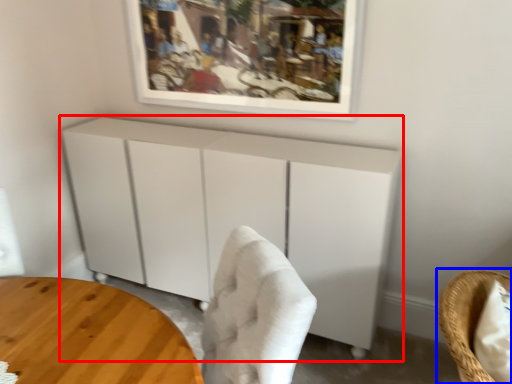
Question: Among these objects, which one is nearest to the camera, cabinetry (highlighted by a red box) or chair (highlighted by a blue box)?

Choices:
 (A) cabinetry
 (B) chair

Answer: (B)